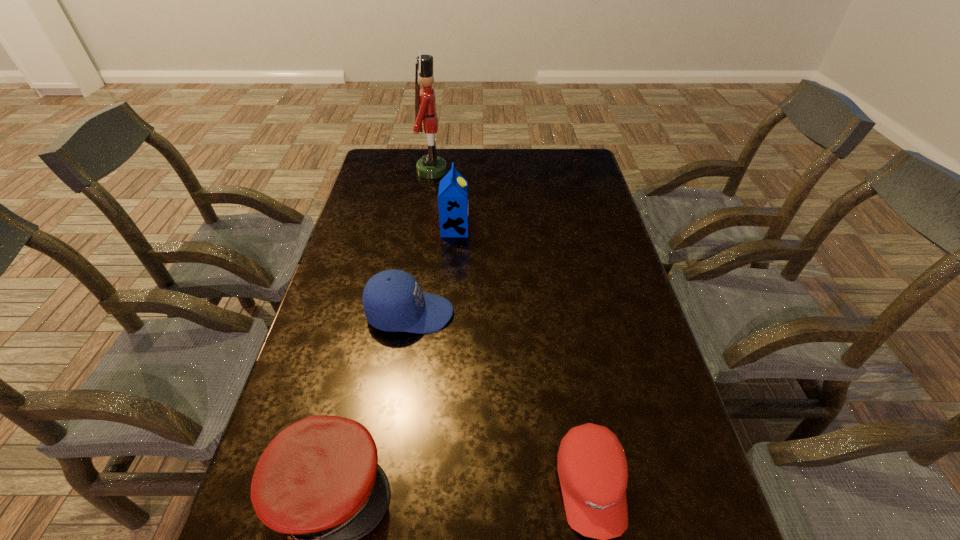
The image size is (960, 540). I want to click on the tallest object, so click(x=430, y=166).

Locate an element on the screen. This screenshot has width=960, height=540. nutcracker is located at coordinates (430, 166).

Locate an element on the screen. The height and width of the screenshot is (540, 960). the second tallest object is located at coordinates (453, 203).

I want to click on carton, so click(x=453, y=203).

Find the location of a particular element. The height and width of the screenshot is (540, 960). the farthest cap is located at coordinates (393, 301).

The image size is (960, 540). What are the coordinates of `the tallest cap` in the screenshot? It's located at (393, 301).

You are a GUI agent. You are given a task and a screenshot of the screen. Output one action in this format:
    pyautogui.click(x=<x>, y=<y>)
    Task: Click on the free location located 0.340m on the front-facing side of the farthest object
    
    Given the screenshot: What is the action you would take?
    pyautogui.click(x=535, y=171)

Find the location of a particular element. The image size is (960, 540). vacant space located with the cap open on the carton is located at coordinates (539, 229).

Identify the location of free region located 0.230m on the front-facing side of the farthest cap. (539, 314).

Find the location of `object that is at the far edge`. object that is at the far edge is located at coordinates (430, 166).